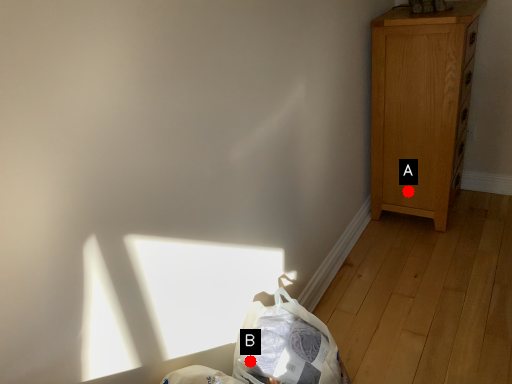
Question: Two points are circled on the image, labeled by A and B beside each circle. Which point is closer to the camera taking this photo?

Choices:
 (A) A is closer
 (B) B is closer

Answer: (B)